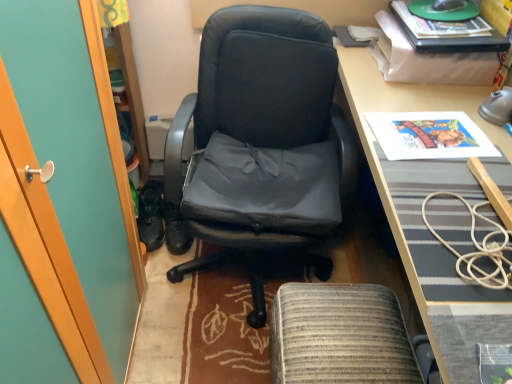
Measure the distance between woven fabric footrest at lower center and camera.

woven fabric footrest at lower center is 1.02 meters away from camera.

The height and width of the screenshot is (384, 512). What do you see at coordinates (429, 135) in the screenshot?
I see `printed paper poster at upper right` at bounding box center [429, 135].

Where is `black leather shoes at lower left`? This screenshot has width=512, height=384. black leather shoes at lower left is located at coordinates (150, 216).

The height and width of the screenshot is (384, 512). I want to click on black plastic mouse at upper right, so click(x=447, y=5).

From the image's perspective, is woven fabric footrest at lower center above or below black plastic mouse at upper right?

From the image's perspective, woven fabric footrest at lower center appears below black plastic mouse at upper right.

From the picture: Considering the sizes of objects woven fabric footrest at lower center and black plastic mouse at upper right in the image provided, who is shorter, woven fabric footrest at lower center or black plastic mouse at upper right?

black plastic mouse at upper right.

From a real-world perspective, between woven fabric footrest at lower center and black plastic mouse at upper right, who is vertically higher?

black plastic mouse at upper right, from a real-world perspective.

Considering the sizes of woven fabric footrest at lower center and black plastic mouse at upper right in the image, is woven fabric footrest at lower center wider or thinner than black plastic mouse at upper right?

Clearly, woven fabric footrest at lower center has more width compared to black plastic mouse at upper right.

Does black leather chair at center turn towards black plastic mouse at upper right?

No, black leather chair at center does not turn towards black plastic mouse at upper right.

Locate an element on the screen. The height and width of the screenshot is (384, 512). mouse above the black leather chair at center (from a real-world perspective) is located at coordinates (447, 5).

From the image's perspective, which is above, black leather chair at center or black plastic mouse at upper right?

black plastic mouse at upper right, from the image's perspective.

Is wooden desk at center at the left side of woven fabric footrest at lower center?

No.

Is point (355, 121) behind point (374, 366)?

Yes, point (355, 121) is farther from viewer.

From the image's perspective, which is above, wooden desk at center or woven fabric footrest at lower center?

From the image's view, wooden desk at center is above.

Between black leather chair at center and printed paper poster at upper right, which one appears on the left side from the viewer's perspective?

From the viewer's perspective, black leather chair at center appears more on the left side.

Is black leather chair at center next to printed paper poster at upper right?

No, black leather chair at center is not beside printed paper poster at upper right.

Does black leather chair at center have a smaller size compared to printed paper poster at upper right?

Actually, black leather chair at center might be larger than printed paper poster at upper right.

Is the position of black leather chair at center more distant than that of black leather shoes at lower left?

No, the depth of black leather chair at center is less than that of black leather shoes at lower left.

From a real-world perspective, is black leather chair at center below black leather shoes at lower left?

No.

From the image's perspective, is black leather chair at center under black leather shoes at lower left?

Actually, black leather chair at center appears above black leather shoes at lower left in the image.

This screenshot has height=384, width=512. Find the location of `footwear behind the black leather chair at center`. footwear behind the black leather chair at center is located at coordinates (150, 216).

Is black leather shoes at lower left aimed at black leather chair at center?

Yes, black leather shoes at lower left is oriented towards black leather chair at center.

Is black leather shoes at lower left in contact with black leather chair at center?

black leather shoes at lower left and black leather chair at center are not in contact.

Can you tell me how much black leather shoes at lower left and black leather chair at center differ in facing direction?

The angular difference between black leather shoes at lower left and black leather chair at center is 16.5 degrees.

From a real-world perspective, relative to wooden desk at center, is printed paper poster at upper right vertically above or below?

Clearly, from a real-world perspective, printed paper poster at upper right is above wooden desk at center.

How many degrees apart are the facing directions of printed paper poster at upper right and wooden desk at center?

The facing directions of printed paper poster at upper right and wooden desk at center are 7.15 degrees apart.

In the image, is printed paper poster at upper right on the left side or the right side of wooden desk at center?

Based on their positions, printed paper poster at upper right is located to the left of wooden desk at center.

Is printed paper poster at upper right next to wooden desk at center?

No, printed paper poster at upper right is not making contact with wooden desk at center.

Where is `mouse behind the woven fabric footrest at lower center`? Image resolution: width=512 pixels, height=384 pixels. mouse behind the woven fabric footrest at lower center is located at coordinates (447, 5).

The image size is (512, 384). What are the coordinates of `chair below the black plastic mouse at upper right (from a real-world perspective)` in the screenshot? It's located at (262, 143).

Considering their positions, is printed paper poster at upper right positioned further to black leather shoes at lower left than black plastic mouse at upper right?

black plastic mouse at upper right is positioned further to the anchor black leather shoes at lower left.

Estimate the real-world distances between objects in this image. Which object is closer to black leather chair at center, woven fabric footrest at lower center or printed paper poster at upper right?

Based on the image, printed paper poster at upper right appears to be nearer to black leather chair at center.

Considering their positions, is black leather chair at center positioned further to wooden desk at center than black plastic mouse at upper right?

black plastic mouse at upper right is further to wooden desk at center.

Looking at the image, which one is located closer to black plastic mouse at upper right, printed paper poster at upper right or black leather chair at center?

Among the two, printed paper poster at upper right is located nearer to black plastic mouse at upper right.

From the image, which object appears to be farther from woven fabric footrest at lower center, black leather chair at center or wooden desk at center?

wooden desk at center lies further to woven fabric footrest at lower center than the other object.

When comparing their distances from wooden desk at center, does black leather shoes at lower left or black plastic mouse at upper right seem closer?

black plastic mouse at upper right.

Looking at the image, which one is located closer to black plastic mouse at upper right, black leather shoes at lower left or wooden desk at center?

Based on the image, wooden desk at center appears to be nearer to black plastic mouse at upper right.

Estimate the real-world distances between objects in this image. Which object is further from black leather chair at center, black leather shoes at lower left or woven fabric footrest at lower center?

black leather shoes at lower left is positioned further to the anchor black leather chair at center.

This screenshot has height=384, width=512. I want to click on chair between printed paper poster at upper right and woven fabric footrest at lower center in the up-down direction, so click(x=262, y=143).

You are a GUI agent. You are given a task and a screenshot of the screen. Output one action in this format:
    pyautogui.click(x=<x>, y=<y>)
    Task: Click on the footrest between wooden desk at center and printed paper poster at upper right in the front-back direction
    This screenshot has height=384, width=512.
    Given the screenshot: What is the action you would take?
    pyautogui.click(x=340, y=336)

Locate an element on the screen. chair situated between black leather shoes at lower left and printed paper poster at upper right from left to right is located at coordinates (262, 143).

Locate an element on the screen. Image resolution: width=512 pixels, height=384 pixels. mouse located between wooden desk at center and black leather shoes at lower left in the depth direction is located at coordinates (447, 5).